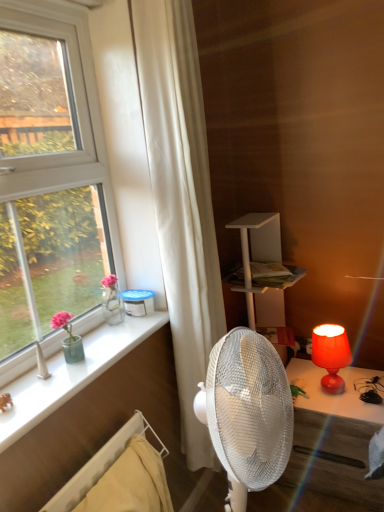
Find the location of a particular element. The height and width of the screenshot is (512, 384). white plastic radiator at lower left is located at coordinates tap(99, 465).

Image resolution: width=384 pixels, height=512 pixels. What are the coordinates of `matte red lamp at right` in the screenshot? It's located at (331, 355).

The image size is (384, 512). What do you see at coordinates (331, 355) in the screenshot? I see `matte red lamp at right` at bounding box center [331, 355].

You are a GUI agent. You are given a task and a screenshot of the screen. Output one action in this format:
    pyautogui.click(x=<x>, y=<y>)
    Task: Click on the matte red lamp at right
    Image resolution: width=384 pixels, height=512 pixels.
    Given the screenshot: What is the action you would take?
    pyautogui.click(x=332, y=438)

Find the location of a particular element. The height and width of the screenshot is (512, 384). white plastic radiator at lower left is located at coordinates (99, 465).

How far apart are white glossy window sill at lower left and matte red lamp at right?

The distance of white glossy window sill at lower left from matte red lamp at right is 36.03 inches.

Does point (22, 379) come farther from viewer compared to point (305, 426)?

No, (22, 379) is closer to viewer.

The image size is (384, 512). Identify the location of window sill located above the matte red lamp at right (from a real-world perspective). (71, 374).

Is point (70, 496) positioned in front of point (316, 429)?

Yes, it is in front of point (316, 429).

From a real-world perspective, is white plastic radiator at lower left below matte red lamp at right?

No, from a real-world perspective, white plastic radiator at lower left is not under matte red lamp at right.

Is matte red lamp at right positioned with its back to white plastic radiator at lower left?

matte red lamp at right does not have its back to white plastic radiator at lower left.

From the image's perspective, is matte red lamp at right located above white plastic radiator at lower left?

Yes, from the image's perspective, matte red lamp at right is on top of white plastic radiator at lower left.

From their relative heights in the image, would you say matte red lamp at right is taller or shorter than white plastic radiator at lower left?

Considering their sizes, matte red lamp at right has less height than white plastic radiator at lower left.

Is matte red lamp at right outside of white plastic radiator at lower left?

matte red lamp at right lies outside white plastic radiator at lower left's area.

Is white fabric curtain at center inside matte red lamp at right?

Actually, white fabric curtain at center is outside matte red lamp at right.

Where is `curtain on the left of matte red lamp at right`? curtain on the left of matte red lamp at right is located at coordinates pos(181,199).

Would you consider matte red lamp at right to be distant from white fabric curtain at center?

No, matte red lamp at right is not far away from white fabric curtain at center.

Is matte red lamp at right facing away from white fabric curtain at center?

matte red lamp at right does not have its back to white fabric curtain at center.

Between point (87, 464) and point (218, 305), which one is positioned behind?

The point (218, 305) is farther from the camera.

Is white plastic radiator at lower left thinner than white fabric curtain at center?

In fact, white plastic radiator at lower left might be wider than white fabric curtain at center.

From a real-world perspective, is white plastic radiator at lower left located higher than white fabric curtain at center?

Incorrect, from a real-world perspective, white plastic radiator at lower left is lower than white fabric curtain at center.

You are a GUI agent. You are given a task and a screenshot of the screen. Output one action in this format:
    pyautogui.click(x=<x>, y=<y>)
    Task: Click on the radiator on the left side of white fabric curtain at center
    The height and width of the screenshot is (512, 384).
    Given the screenshot: What is the action you would take?
    pyautogui.click(x=99, y=465)

From the image's perspective, which is above, white glossy window sill at lower left or white fabric curtain at center?

white fabric curtain at center.

Considering the positions of point (8, 414) and point (185, 49), is point (8, 414) closer or farther from the camera than point (185, 49)?

Point (8, 414) is closer to the camera than point (185, 49).

Based on their positions, is white glossy window sill at lower left located to the left or right of white fabric curtain at center?

Based on their positions, white glossy window sill at lower left is located to the left of white fabric curtain at center.

From a real-world perspective, is white glossy window sill at lower left above or below white fabric curtain at center?

In terms of real-world spatial position, white glossy window sill at lower left is below white fabric curtain at center.

In the scene shown: Is white fabric curtain at center positioned in front of white plastic radiator at lower left?

No, it is not.

Which is behind, point (169, 250) or point (55, 496)?

The point (169, 250) is behind.

Which object is positioned more to the left, white fabric curtain at center or white plastic radiator at lower left?

From the viewer's perspective, white plastic radiator at lower left appears more on the left side.

How distant is white fabric curtain at center from white plastic radiator at lower left?

A distance of 24.34 inches exists between white fabric curtain at center and white plastic radiator at lower left.

I want to click on table directly beneath the white glossy window sill at lower left (from a real-world perspective), so click(x=332, y=438).

Locate an element on the screen. This screenshot has height=512, width=384. radiator above the matte red lamp at right (from the image's perspective) is located at coordinates (99, 465).

Looking at the image, which one is located further to white plastic radiator at lower left, white fabric curtain at center or matte red lamp at right?

The object further to white plastic radiator at lower left is matte red lamp at right.

When comparing their distances from matte red lamp at right, does white fabric curtain at center or matte red lamp at right seem closer?

The object closer to matte red lamp at right is matte red lamp at right.

Looking at the image, which one is located closer to white fabric curtain at center, white plastic radiator at lower left or matte red lamp at right?

white plastic radiator at lower left is positioned closer to the anchor white fabric curtain at center.

From the picture: Which object lies nearer to the anchor point white fabric curtain at center, white glossy window sill at lower left or matte red lamp at right?

Based on the image, white glossy window sill at lower left appears to be nearer to white fabric curtain at center.

When comparing their distances from white plastic radiator at lower left, does matte red lamp at right or white glossy window sill at lower left seem further?

The object further to white plastic radiator at lower left is matte red lamp at right.

Based on their spatial positions, is matte red lamp at right or matte red lamp at right further from white plastic radiator at lower left?

matte red lamp at right is positioned further to the anchor white plastic radiator at lower left.

Which object lies further to the anchor point matte red lamp at right, white plastic radiator at lower left or matte red lamp at right?

white plastic radiator at lower left lies further to matte red lamp at right than the other object.

Based on their spatial positions, is matte red lamp at right or white glossy window sill at lower left closer to matte red lamp at right?

The object closer to matte red lamp at right is matte red lamp at right.

Locate an element on the screen. lamp situated between white plastic radiator at lower left and matte red lamp at right from left to right is located at coordinates (331, 355).

Find the location of a particular element. The image size is (384, 512). window sill between white fabric curtain at center and white plastic radiator at lower left in the up-down direction is located at coordinates (71, 374).

The height and width of the screenshot is (512, 384). Find the location of `lamp between white fabric curtain at center and matte red lamp at right from top to bottom`. lamp between white fabric curtain at center and matte red lamp at right from top to bottom is located at coordinates (331, 355).

Locate an element on the screen. curtain between white glossy window sill at lower left and matte red lamp at right in the horizontal direction is located at coordinates (181, 199).